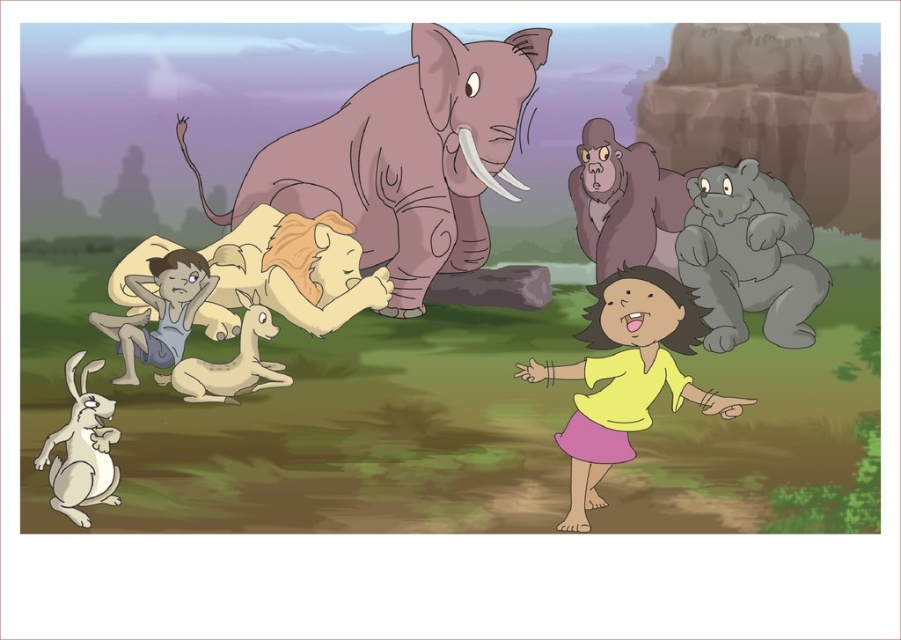
Question: Considering the real-world distances, which object is farthest from the blue denim shorts at lower left?

Choices:
 (A) white matte rabbit at lower left
 (B) white fur antelope at center
 (C) gray matte elephant at upper center
 (D) yellow matte shirt at center

Answer: (C)

Question: Considering the relative positions of purple matte elephant at center and white fur antelope at center in the image provided, where is purple matte elephant at center located with respect to white fur antelope at center?

Choices:
 (A) right
 (B) left

Answer: (A)

Question: Observing the image, what is the correct spatial positioning of gray matte bear at upper right in reference to white matte rabbit at lower left?

Choices:
 (A) right
 (B) left

Answer: (A)

Question: Does blue denim shorts at lower left appear on the right side of white matte rabbit at lower left?

Choices:
 (A) no
 (B) yes

Answer: (B)

Question: Which point appears farthest from the camera in this image?

Choices:
 (A) (280, 369)
 (B) (398, 301)
 (C) (708, 321)

Answer: (B)

Question: Which object is positioned farthest from the white fur antelope at center?

Choices:
 (A) gray matte elephant at upper center
 (B) white matte rabbit at lower left

Answer: (A)